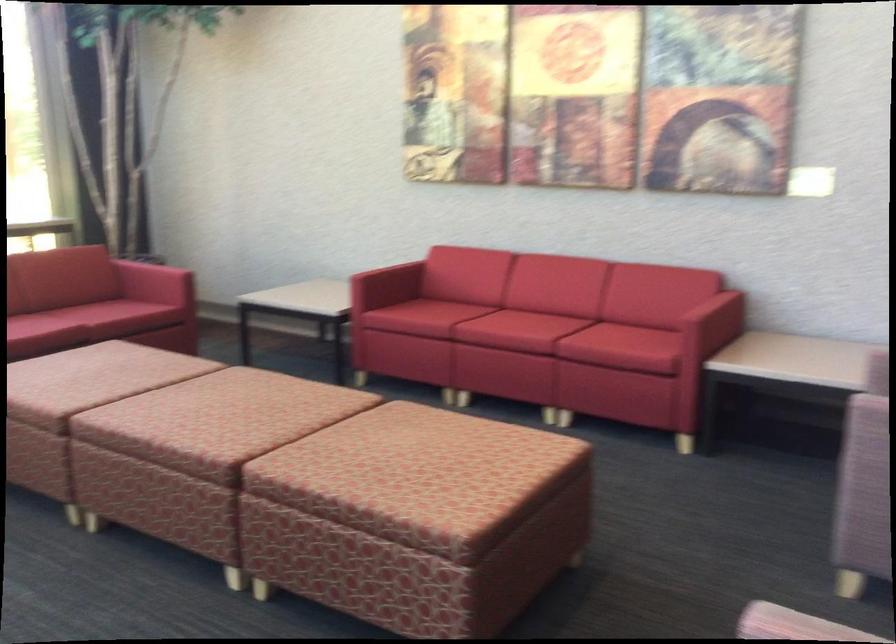
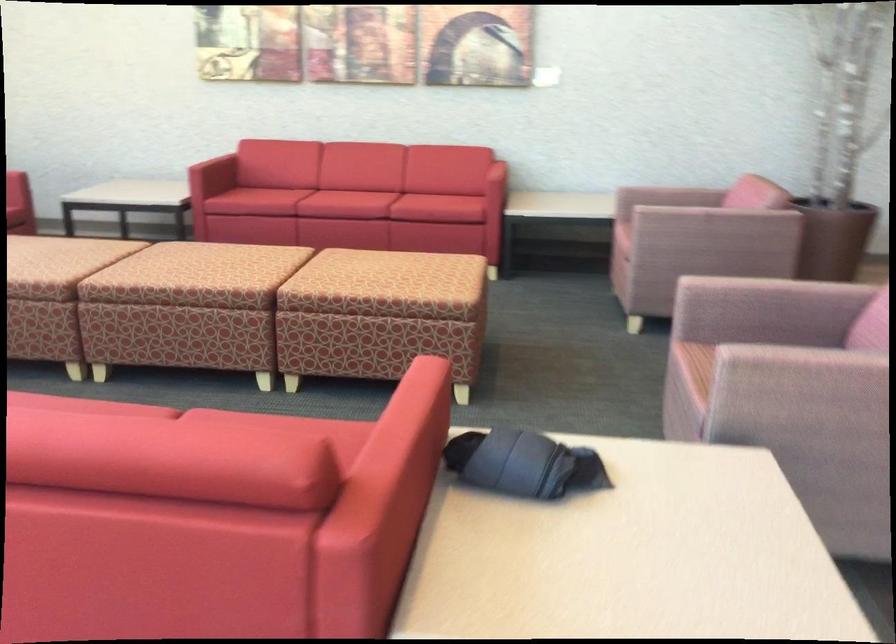
Question: I am providing you with two images of the same scene from different viewpoints. After the viewpoint changes to image2, which objects are now occluded?

Choices:
 (A) red sofa armrest
 (B) red sofa sitting surface
 (C) rolled up clothing
 (D) none of these

Answer: (D)